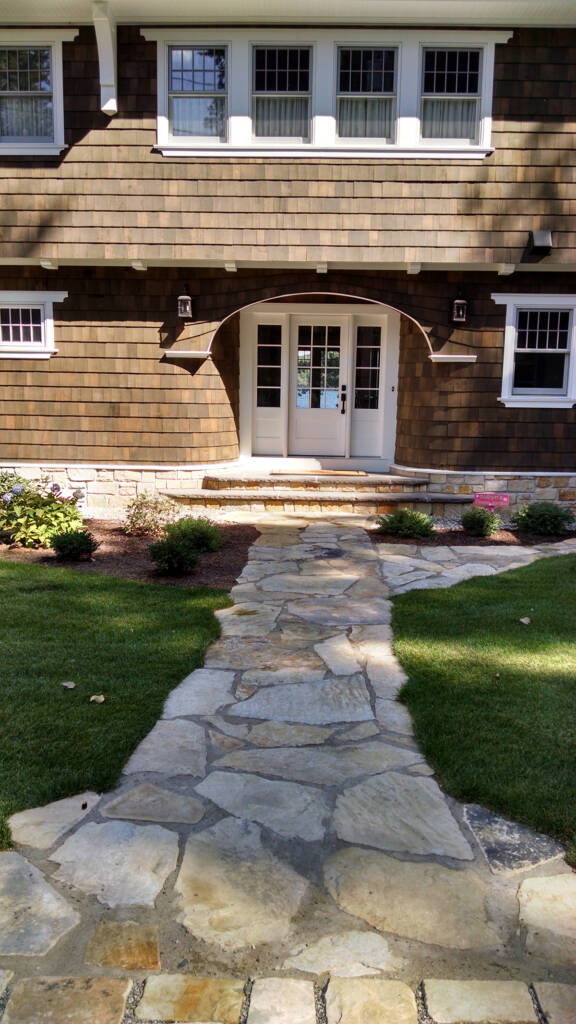
Locate an element on the screen. door is located at coordinates (319, 411).